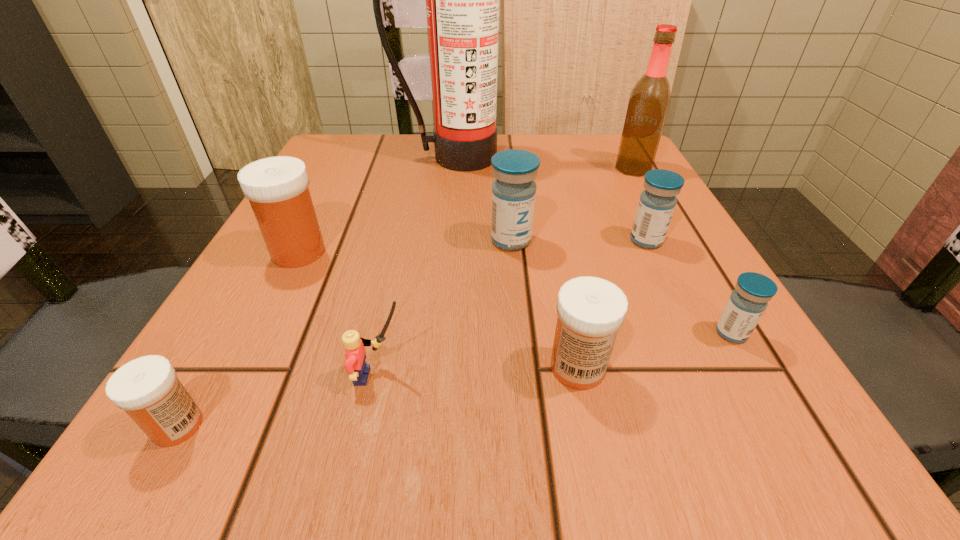
This screenshot has height=540, width=960. I want to click on the rightmost blue medicine, so click(x=747, y=303).

Locate an element on the screen. The height and width of the screenshot is (540, 960). the nearest blue medicine is located at coordinates (747, 303).

Identify the location of the nearest white medicine. Image resolution: width=960 pixels, height=540 pixels. (147, 388).

Image resolution: width=960 pixels, height=540 pixels. In order to click on the smallest white medicine in this screenshot , I will do `click(147, 388)`.

What are the coordinates of `free space located on the front-facing side of the tallest object` in the screenshot? It's located at (449, 186).

This screenshot has width=960, height=540. What are the coordinates of `free space located 0.240m on the left of the beer bottle` in the screenshot? It's located at (504, 168).

Locate an element on the screen. This screenshot has height=540, width=960. free space located 0.390m on the left of the leftmost blue medicine is located at coordinates pos(264,240).

Where is `vacant region located 0.220m on the right of the biggest white medicine`? This screenshot has height=540, width=960. vacant region located 0.220m on the right of the biggest white medicine is located at coordinates (458, 252).

Find the location of `free space located 0.060m on the front of the second blue medicine from left to right`. free space located 0.060m on the front of the second blue medicine from left to right is located at coordinates (662, 274).

Where is `vacant area situated 0.280m on the back of the second smallest white medicine`? The image size is (960, 540). vacant area situated 0.280m on the back of the second smallest white medicine is located at coordinates (548, 225).